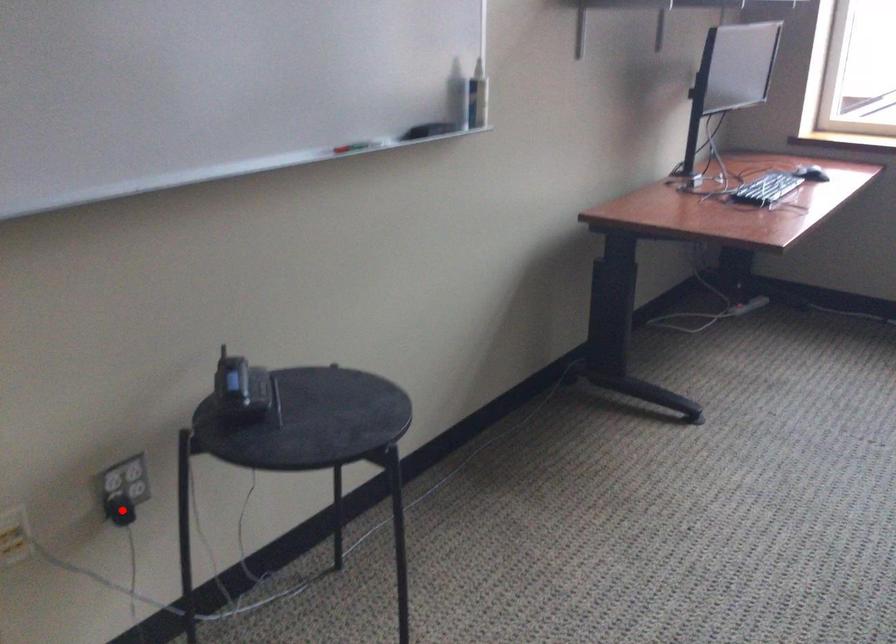
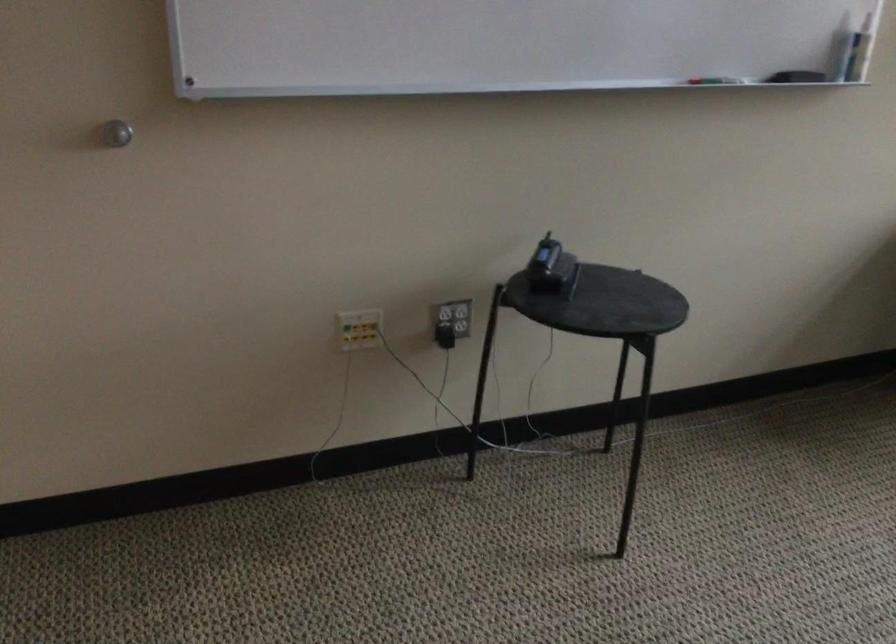
Question: I am providing you with two images of the same scene from different viewpoints. Given a red point in image1, look at the same physical point in image2. Is it:

Choices:
 (A) Closer to the viewpoint
 (B) Farther from the viewpoint

Answer: (B)